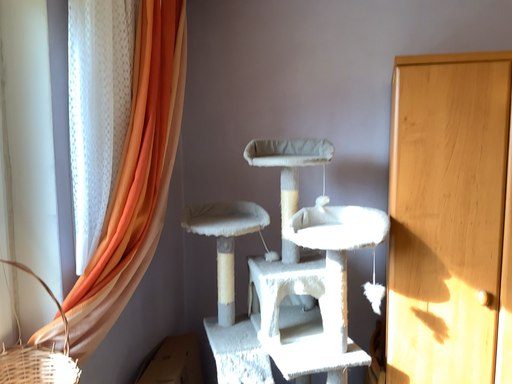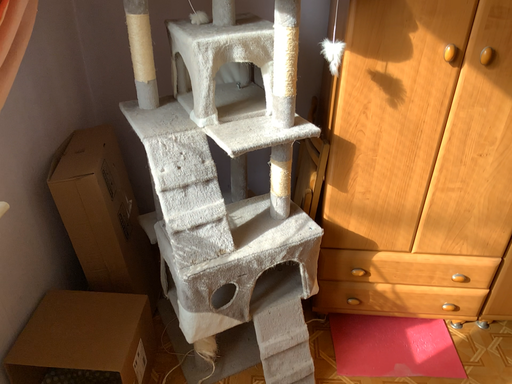
Question: How did the camera likely rotate when shooting the video?

Choices:
 (A) rotated left
 (B) rotated right

Answer: (B)